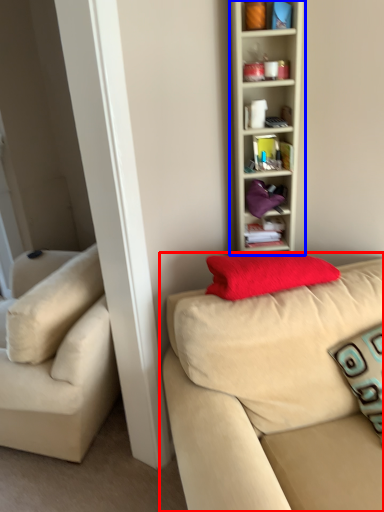
Question: Which object is closer to the camera taking this photo, studio couch (highlighted by a red box) or shelf (highlighted by a blue box)?

Choices:
 (A) studio couch
 (B) shelf

Answer: (A)